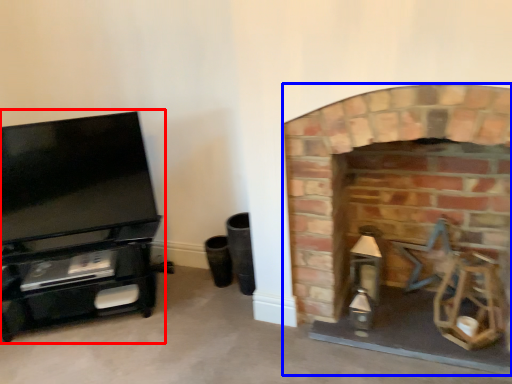
Question: Which point is further to the camera, entertainment center (highlighted by a red box) or fireplace (highlighted by a blue box)?

Choices:
 (A) entertainment center
 (B) fireplace

Answer: (A)